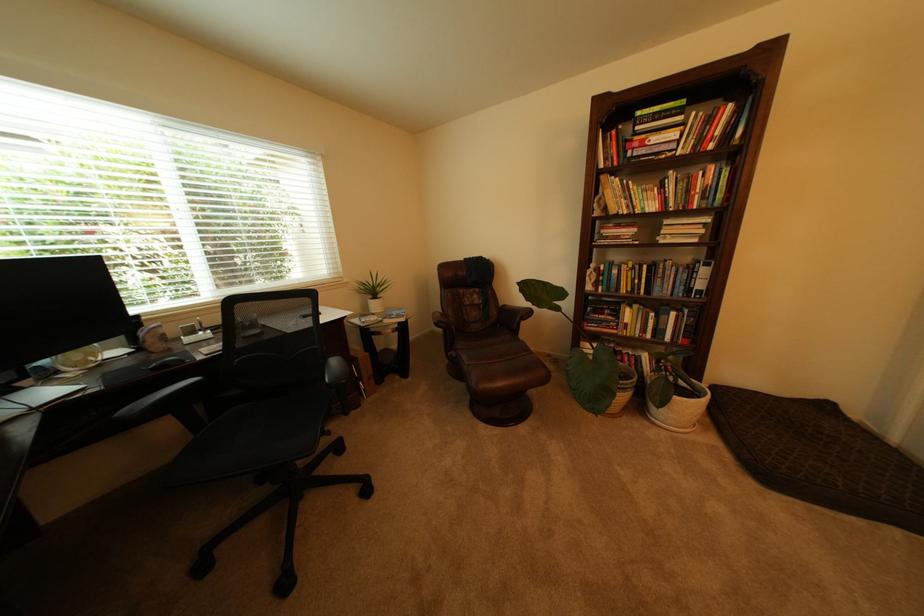
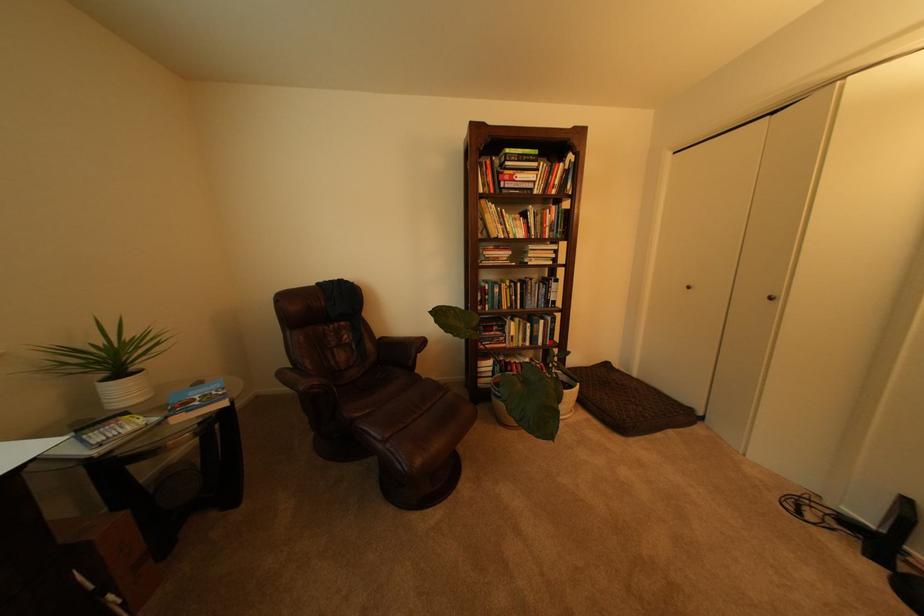
Question: The camera is either moving clockwise (left) or counter-clockwise (right) around the object. The first image is from the beginning of the video and the second image is from the end. Is the camera moving left or right when shooting the video?

Choices:
 (A) Left
 (B) Right

Answer: (A)